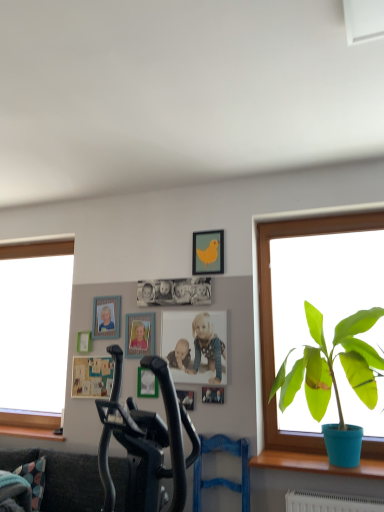
Question: Is matte photo frame at center shorter than metallic silver picture frame at center, arranged as the fifth picture frame when viewed from the left?

Choices:
 (A) no
 (B) yes

Answer: (A)

Question: Can you confirm if matte photo frame at center is thinner than metallic silver picture frame at center, the 3th picture frame viewed from the right?

Choices:
 (A) yes
 (B) no

Answer: (A)

Question: From the image's perspective, is matte photo frame at center located above metallic silver picture frame at center, the 3th picture frame viewed from the right?

Choices:
 (A) no
 (B) yes

Answer: (B)

Question: Is matte photo frame at center facing towards metallic silver picture frame at center, arranged as the fifth picture frame when viewed from the left?

Choices:
 (A) no
 (B) yes

Answer: (A)

Question: Does matte photo frame at center come behind metallic silver picture frame at center, the 3th picture frame viewed from the right?

Choices:
 (A) yes
 (B) no

Answer: (B)

Question: From a real-world perspective, is blue fabric swivel chair at center positioned above or below green matte plant at right?

Choices:
 (A) below
 (B) above

Answer: (A)

Question: In terms of width, does blue fabric swivel chair at center look wider or thinner when compared to green matte plant at right?

Choices:
 (A) thin
 (B) wide

Answer: (B)

Question: Visually, is blue fabric swivel chair at center positioned to the left or to the right of green matte plant at right?

Choices:
 (A) right
 (B) left

Answer: (B)

Question: In the image, is blue fabric swivel chair at center positioned in front of or behind green matte plant at right?

Choices:
 (A) behind
 (B) front

Answer: (A)

Question: Considering the positions of blue fabric swivel chair at center and wooden photo frame at upper left, the 3th picture frame in the left-to-right sequence, in the image, is blue fabric swivel chair at center taller or shorter than wooden photo frame at upper left, the 3th picture frame in the left-to-right sequence,?

Choices:
 (A) short
 (B) tall

Answer: (B)

Question: Which is correct: blue fabric swivel chair at center is inside wooden photo frame at upper left, the 3th picture frame in the left-to-right sequence, or outside of it?

Choices:
 (A) inside
 (B) outside

Answer: (B)

Question: Considering the positions of blue fabric swivel chair at center and wooden photo frame at upper left, the 3th picture frame in the left-to-right sequence, in the image, is blue fabric swivel chair at center wider or thinner than wooden photo frame at upper left, the 3th picture frame in the left-to-right sequence,?

Choices:
 (A) wide
 (B) thin

Answer: (A)

Question: In terms of size, does blue fabric swivel chair at center appear bigger or smaller than wooden photo frame at upper left, the 3th picture frame in the left-to-right sequence?

Choices:
 (A) small
 (B) big

Answer: (B)

Question: Considering the positions of point (87, 332) and point (248, 503), is point (87, 332) closer or farther from the camera than point (248, 503)?

Choices:
 (A) closer
 (B) farther

Answer: (B)

Question: Considering the relative positions of matte green picture frame at upper left, the 1th picture frame in the left-to-right sequence, and blue fabric swivel chair at center in the image provided, is matte green picture frame at upper left, the 1th picture frame in the left-to-right sequence, to the left or to the right of blue fabric swivel chair at center?

Choices:
 (A) left
 (B) right

Answer: (A)